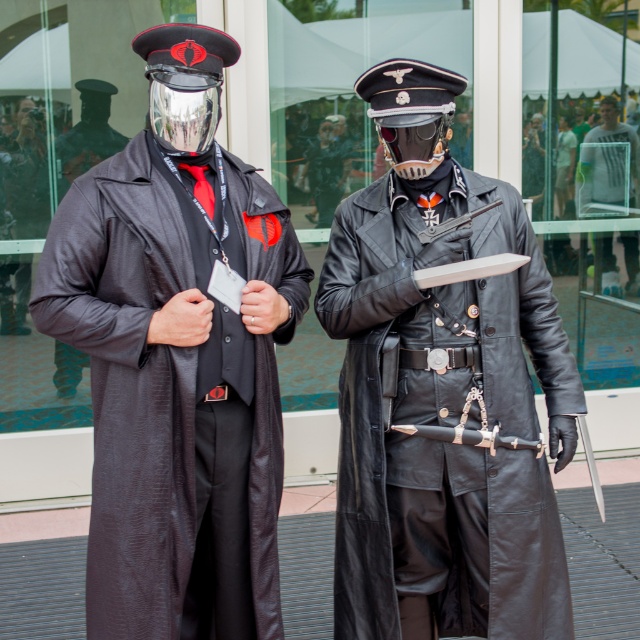
Question: Is matte black robe at left below metallic silver helmet at center?

Choices:
 (A) yes
 (B) no

Answer: (A)

Question: Among these objects, which one is nearest to the camera?

Choices:
 (A) metallic silver helmet at center
 (B) matte black robe at left

Answer: (B)

Question: Estimate the real-world distances between objects in this image. Which object is closer to the matte black robe at left?

Choices:
 (A) metallic reflective helmet at upper left
 (B) light gray fabric shirt at center

Answer: (A)

Question: Is metallic reflective helmet at upper left thinner than metallic silver helmet at center?

Choices:
 (A) no
 (B) yes

Answer: (B)

Question: Can you confirm if matte black robe at left is thinner than metallic silver helmet at center?

Choices:
 (A) yes
 (B) no

Answer: (B)

Question: Which of the following is the closest to the observer?

Choices:
 (A) metallic reflective helmet at upper left
 (B) black leather coat at center
 (C) metallic silver helmet at center

Answer: (A)